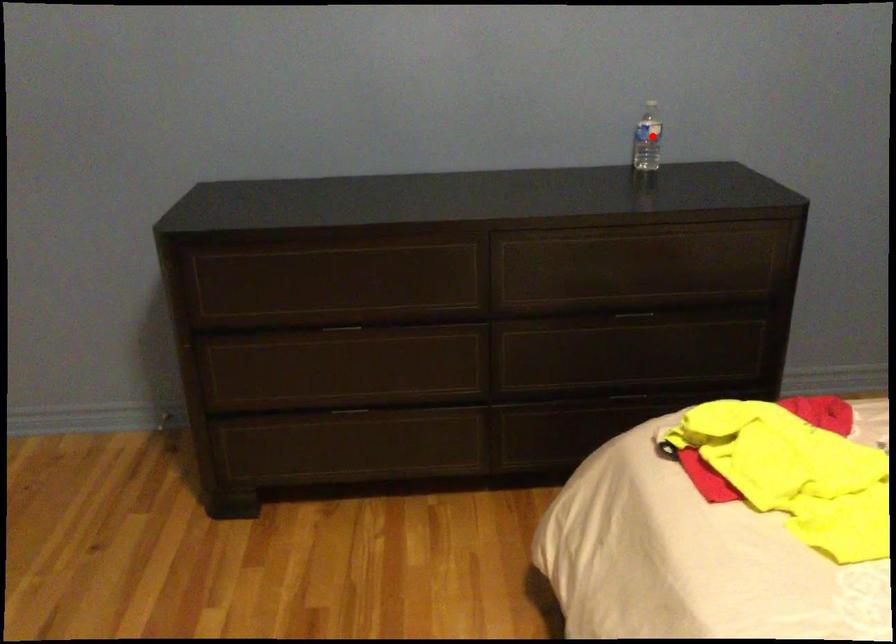
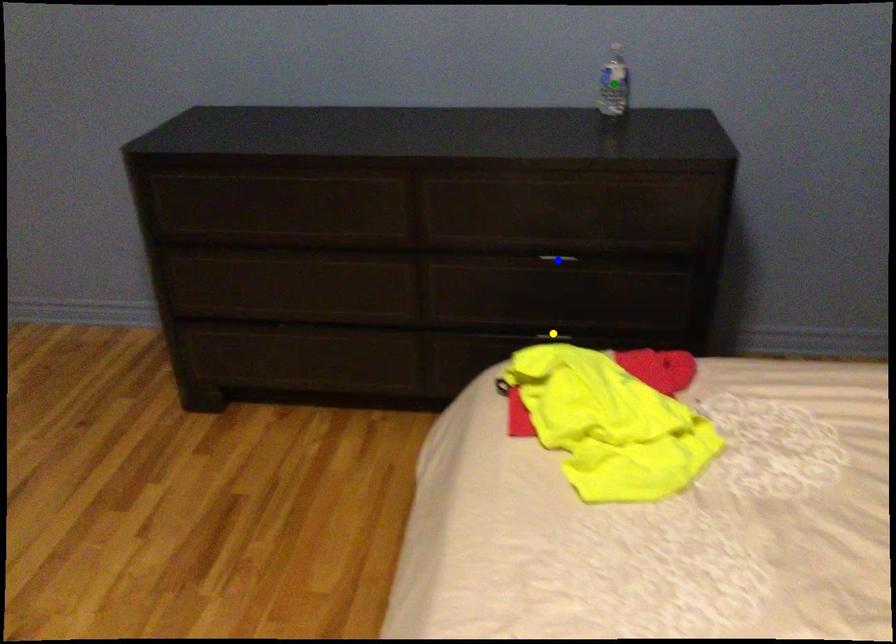
Question: I am providing you with two images of the same scene from different viewpoints. A red point is marked on the first image. You are given multiple points on the second image. In image 2, which mark is for the same physical point as the one in image 1?

Choices:
 (A) yellow point
 (B) green point
 (C) blue point

Answer: (B)